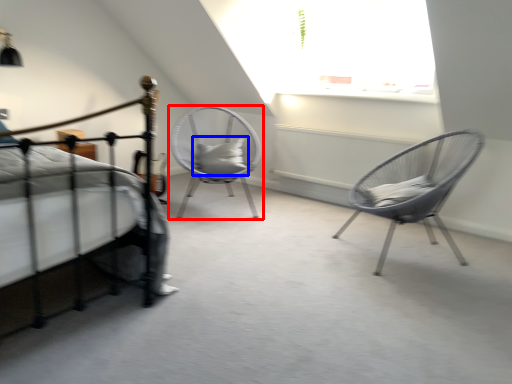
Question: Which object appears closest to the camera in this image, chair (highlighted by a red box) or pillow (highlighted by a blue box)?

Choices:
 (A) chair
 (B) pillow

Answer: (A)